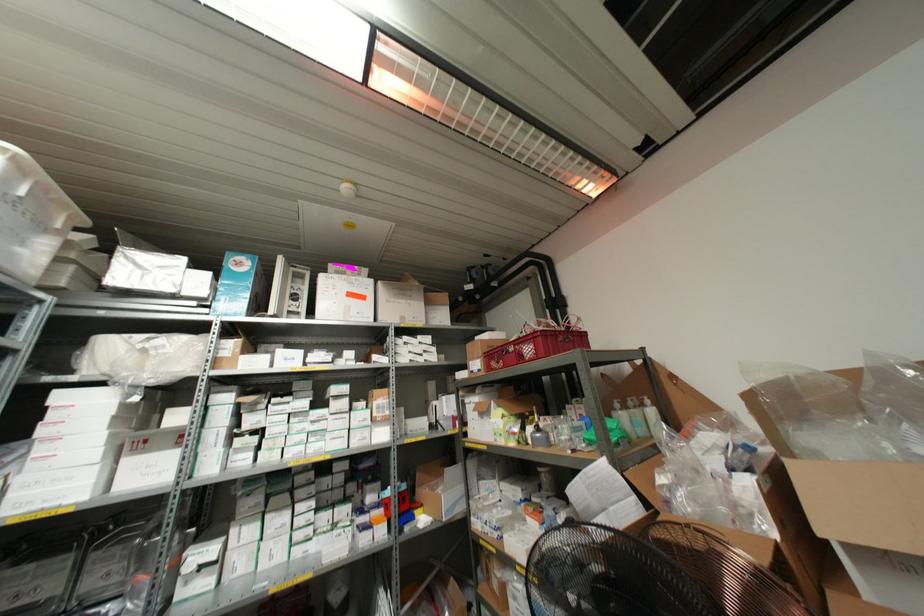
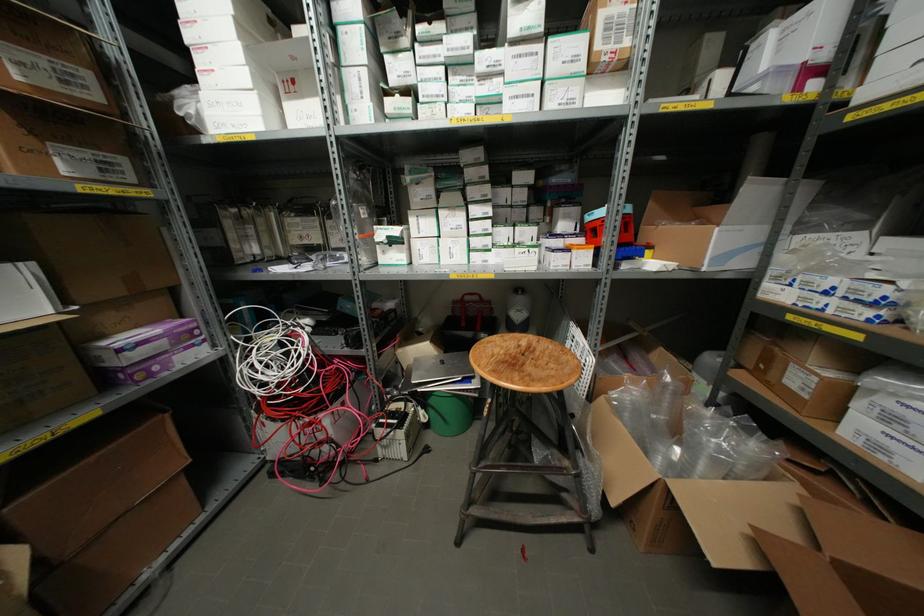
The point at (91, 480) is marked in the first image. Where is the corresponding point in the second image?

(257, 111)